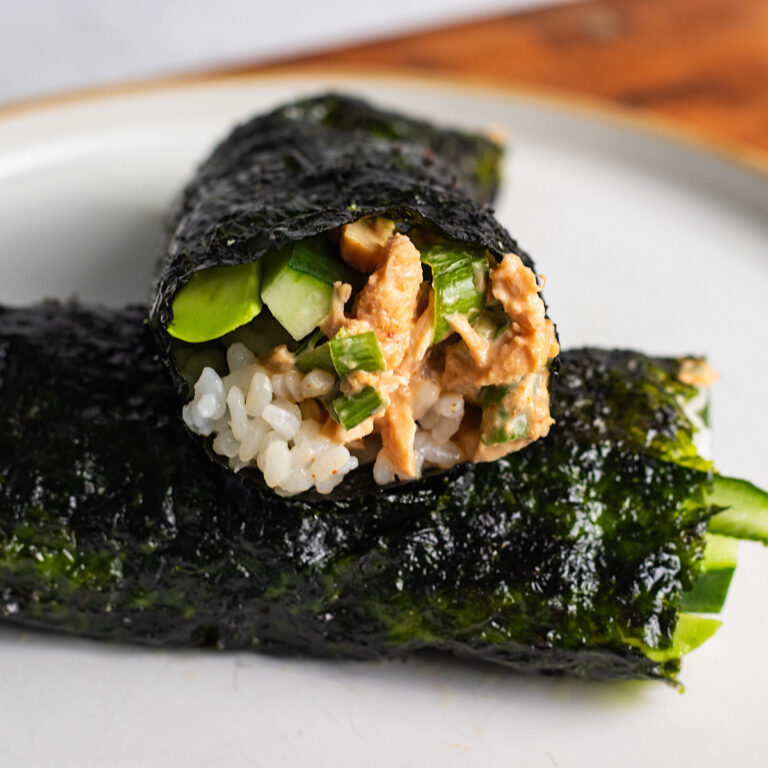
Locate an element on the screen. table is located at coordinates (694, 121).